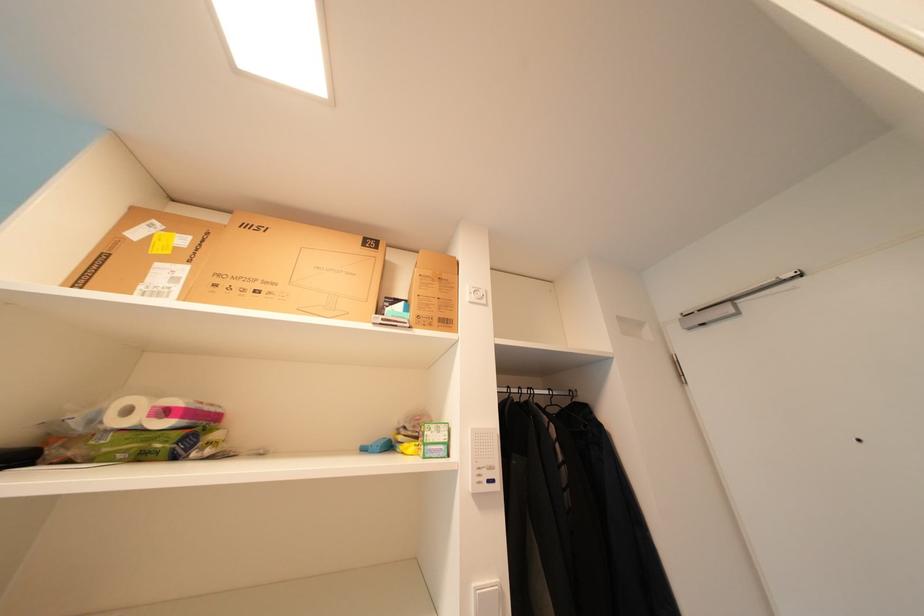
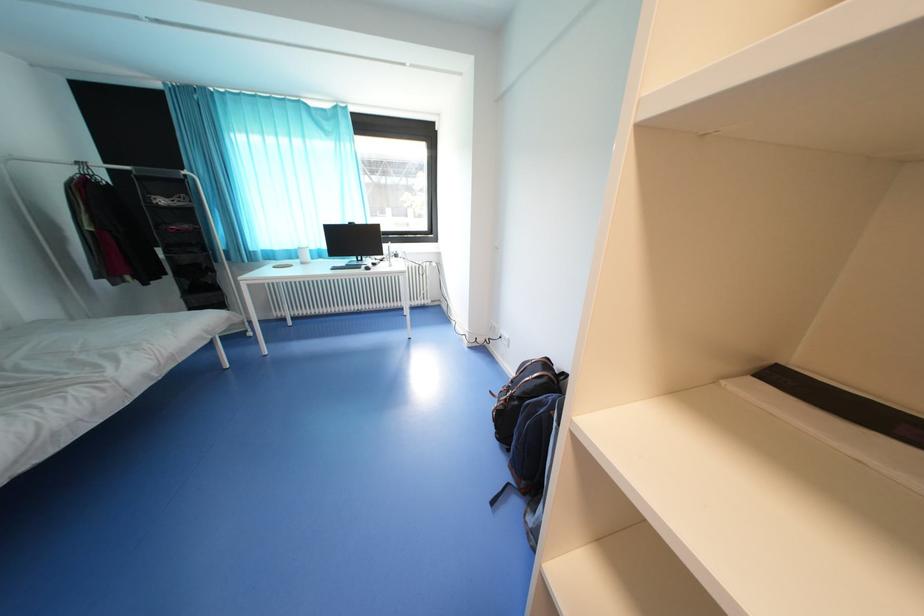
The first image is from the beginning of the video and the second image is from the end. How did the camera likely rotate when shooting the video?

The camera's rotation is toward left-down.